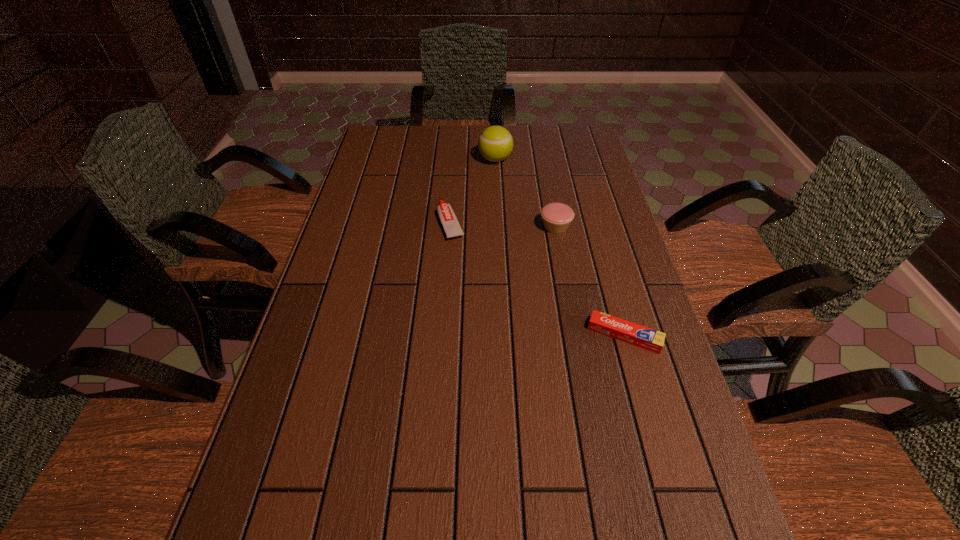
You are a GUI agent. You are given a task and a screenshot of the screen. Output one action in this format:
    pyautogui.click(x=<x>, y=<y>)
    Task: Click on the vacant region between the nearer toothpaste and the cupcake
    The image size is (960, 540).
    Given the screenshot: What is the action you would take?
    pyautogui.click(x=590, y=281)

Locate an element on the screen. The height and width of the screenshot is (540, 960). unoccupied position between the third shortest object and the left toothpaste is located at coordinates (503, 225).

Find the location of `free spot between the third tallest object and the cupcake`. free spot between the third tallest object and the cupcake is located at coordinates (503, 225).

Find the location of a particular element. This screenshot has width=960, height=540. empty space that is in between the taller toothpaste and the second tallest object is located at coordinates (503, 225).

This screenshot has width=960, height=540. Identify the location of empty space between the left toothpaste and the tennis ball. (473, 191).

This screenshot has height=540, width=960. Identify the location of unoccupied position between the shorter toothpaste and the cupcake. (590, 281).

Find the location of `free space that is in between the farthest object and the farther toothpaste`. free space that is in between the farthest object and the farther toothpaste is located at coordinates (473, 191).

The width and height of the screenshot is (960, 540). I want to click on free spot between the shorter toothpaste and the cupcake, so click(590, 281).

Where is `object that stands as the third closest to the farthest object`? object that stands as the third closest to the farthest object is located at coordinates (631, 333).

Locate which object ranks in proximity to the cupcake. Please provide its 2D coordinates. Your answer should be formatted as a tuple, i.e. [(x, y)], where the tuple contains the x and y coordinates of a point satisfying the conditions above.

[(452, 228)]